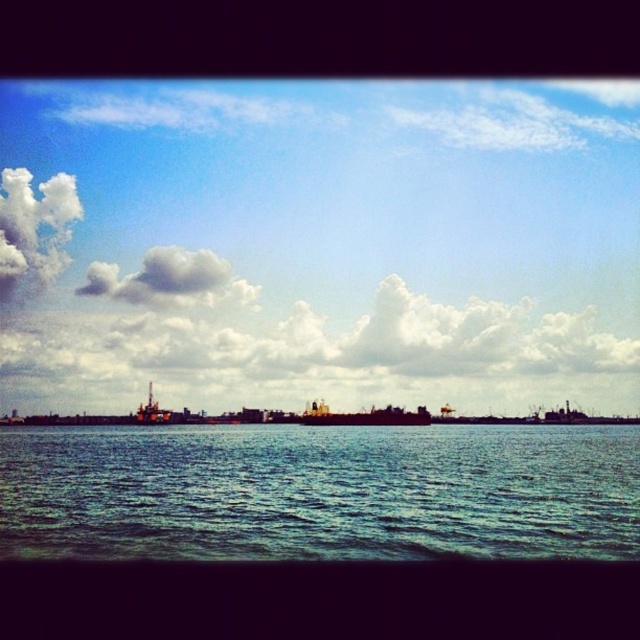
Question: Can you confirm if white fluffy cloud at upper center is smaller than dark gray metallic ship at center?

Choices:
 (A) no
 (B) yes

Answer: (A)

Question: Is blue sky at upper center to the left of white fluffy cloud at upper center from the viewer's perspective?

Choices:
 (A) no
 (B) yes

Answer: (A)

Question: Which object is the farthest from the blue sky at upper center?

Choices:
 (A) white fluffy cloud at upper center
 (B) dark gray metallic ship at center
 (C) blue water at center

Answer: (C)

Question: Considering the real-world distances, which object is farthest from the white fluffy cloud at upper left?

Choices:
 (A) dark gray metallic ship at center
 (B) blue sky at upper center
 (C) white fluffy cloud at upper center

Answer: (A)

Question: Can you confirm if blue sky at upper center is positioned below dark gray metallic ship at center?

Choices:
 (A) yes
 (B) no

Answer: (B)

Question: Which point appears farthest from the camera in this image?

Choices:
 (A) (413, 413)
 (B) (129, 298)

Answer: (B)